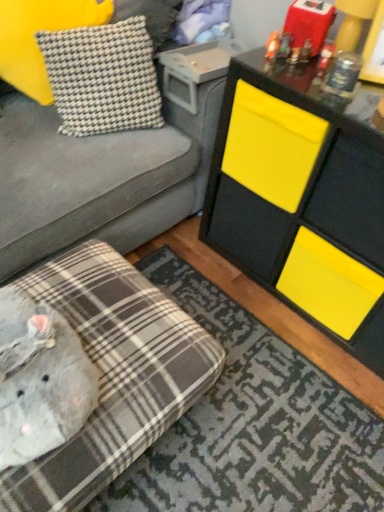
Question: Is yellow matte cabinet at upper right beside gray corduroy studio couch at upper left, the 1th studio couch viewed from the top?

Choices:
 (A) no
 (B) yes

Answer: (A)

Question: From a real-world perspective, is yellow matte cabinet at upper right on gray corduroy studio couch at upper left, which is the 2th studio couch from bottom to top?

Choices:
 (A) no
 (B) yes

Answer: (B)

Question: Could you tell me if yellow matte cabinet at upper right is turned towards gray corduroy studio couch at upper left, which is the 2th studio couch from bottom to top?

Choices:
 (A) no
 (B) yes

Answer: (A)

Question: Considering the relative sizes of yellow matte cabinet at upper right and gray corduroy studio couch at upper left, the 1th studio couch viewed from the top, in the image provided, is yellow matte cabinet at upper right wider than gray corduroy studio couch at upper left, the 1th studio couch viewed from the top,?

Choices:
 (A) yes
 (B) no

Answer: (B)

Question: From the image's perspective, is yellow matte cabinet at upper right on gray corduroy studio couch at upper left, the 1th studio couch viewed from the top?

Choices:
 (A) yes
 (B) no

Answer: (B)

Question: Considering the positions of yellow matte cabinet at upper right and plaid fabric ottoman at lower left, which is counted as the second studio couch, starting from the top, in the image, is yellow matte cabinet at upper right wider or thinner than plaid fabric ottoman at lower left, which is counted as the second studio couch, starting from the top,?

Choices:
 (A) thin
 (B) wide

Answer: (A)

Question: From the image's perspective, is yellow matte cabinet at upper right positioned above or below plaid fabric ottoman at lower left, which is counted as the second studio couch, starting from the top?

Choices:
 (A) above
 (B) below

Answer: (A)

Question: From a real-world perspective, relative to plaid fabric ottoman at lower left, which is counted as the second studio couch, starting from the top, is yellow matte cabinet at upper right vertically above or below?

Choices:
 (A) above
 (B) below

Answer: (A)

Question: In terms of height, does yellow matte cabinet at upper right look taller or shorter compared to plaid fabric ottoman at lower left, which is counted as the second studio couch, starting from the top?

Choices:
 (A) tall
 (B) short

Answer: (A)

Question: Is point (142, 53) positioned closer to the camera than point (241, 96)?

Choices:
 (A) farther
 (B) closer

Answer: (A)

Question: Considering the positions of houndstooth fabric pillow at upper left, placed as the 1th pillow when sorted from right to left, and yellow matte cabinet at upper right in the image, is houndstooth fabric pillow at upper left, placed as the 1th pillow when sorted from right to left, taller or shorter than yellow matte cabinet at upper right?

Choices:
 (A) tall
 (B) short

Answer: (B)

Question: Do you think houndstooth fabric pillow at upper left, placed as the 1th pillow when sorted from right to left, is within yellow matte cabinet at upper right, or outside of it?

Choices:
 (A) inside
 (B) outside

Answer: (B)

Question: Is houndstooth fabric pillow at upper left, placed as the 1th pillow when sorted from right to left, in front of or behind yellow matte cabinet at upper right in the image?

Choices:
 (A) front
 (B) behind

Answer: (B)

Question: From the image's perspective, is houndstooth fabric pillow at upper left, arranged as the first pillow when viewed from the left, located above or below gray corduroy studio couch at upper left, the 1th studio couch viewed from the top?

Choices:
 (A) below
 (B) above

Answer: (B)

Question: Is houndstooth fabric pillow at upper left, marked as the 2th pillow in a right-to-left arrangement, in front of or behind gray corduroy studio couch at upper left, which is the 2th studio couch from bottom to top, in the image?

Choices:
 (A) behind
 (B) front

Answer: (A)